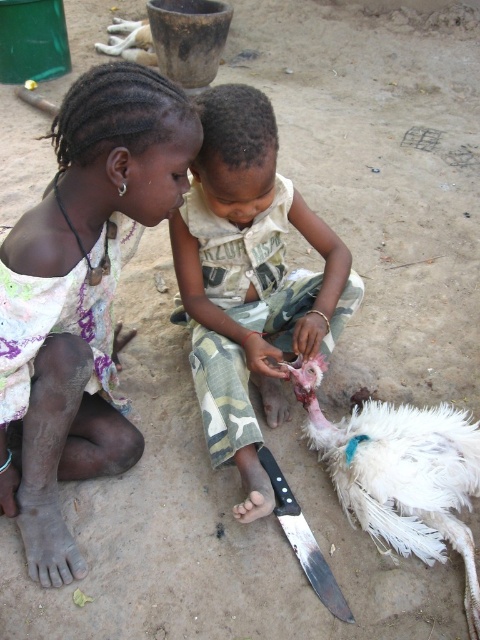
Question: Based on their relative distances, which object is farther from the black plastic knife at lower center?

Choices:
 (A) white feathered bird at lower right
 (B) matte white dress at left
 (C) camouflage pants at center

Answer: (B)

Question: Which point is closer to the camera?

Choices:
 (A) white feathered bird at lower right
 (B) black plastic knife at lower center
 (C) matte white dress at left

Answer: (C)

Question: Is camouflage pants at center thinner than black plastic knife at lower center?

Choices:
 (A) yes
 (B) no

Answer: (B)

Question: Which of the following is the closest to the observer?

Choices:
 (A) camouflage pants at center
 (B) black plastic knife at lower center
 (C) white feathered bird at lower right
 (D) matte white dress at left

Answer: (D)

Question: Can you confirm if white feathered bird at lower right is positioned to the left of black plastic knife at lower center?

Choices:
 (A) yes
 (B) no

Answer: (B)

Question: Is matte white dress at left behind black plastic knife at lower center?

Choices:
 (A) yes
 (B) no

Answer: (B)